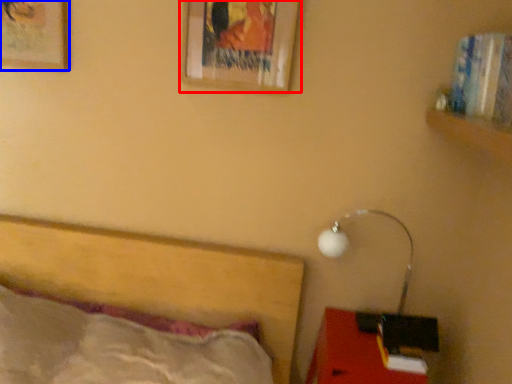
Question: Among these objects, which one is farthest to the camera, picture frame (highlighted by a red box) or picture frame (highlighted by a blue box)?

Choices:
 (A) picture frame
 (B) picture frame

Answer: (B)